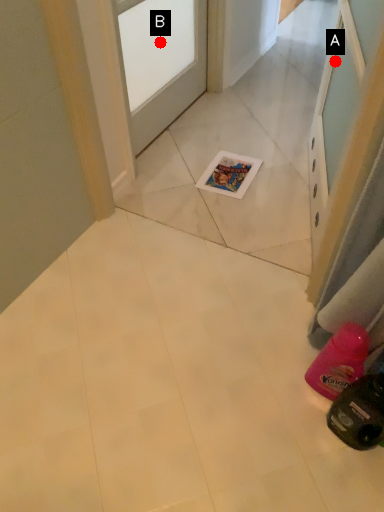
Question: Two points are circled on the image, labeled by A and B beside each circle. Which point is closer to the camera?

Choices:
 (A) A is closer
 (B) B is closer

Answer: (A)